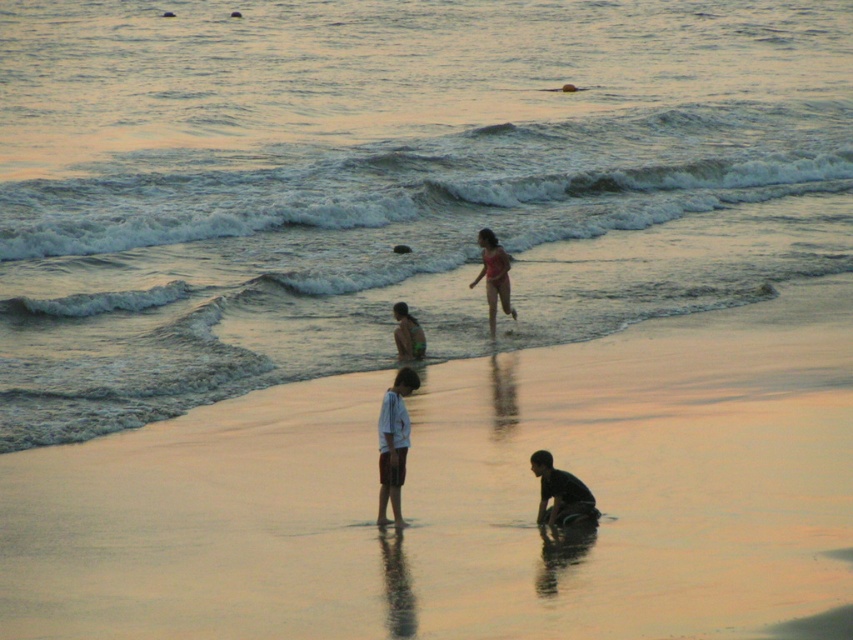
You are planning to set up a picnic blanket on the beach. The smooth sand at center and the white cotton shirt at center are in the area. Which area has a wider space to accommodate the blanket?

The smooth sand at center has a wider space than the white cotton shirt at center, so it can accommodate the picnic blanket better.

Based on the photo, you are standing at the origin point of the coordinate system. You want to move towards the white cotton shirt at center. Which direction should you move in?

Since the white cotton shirt at center is located at coordinate point 0.694 in the x direction and 0.462 in the y direction, you should move towards the northeast direction to reach it.